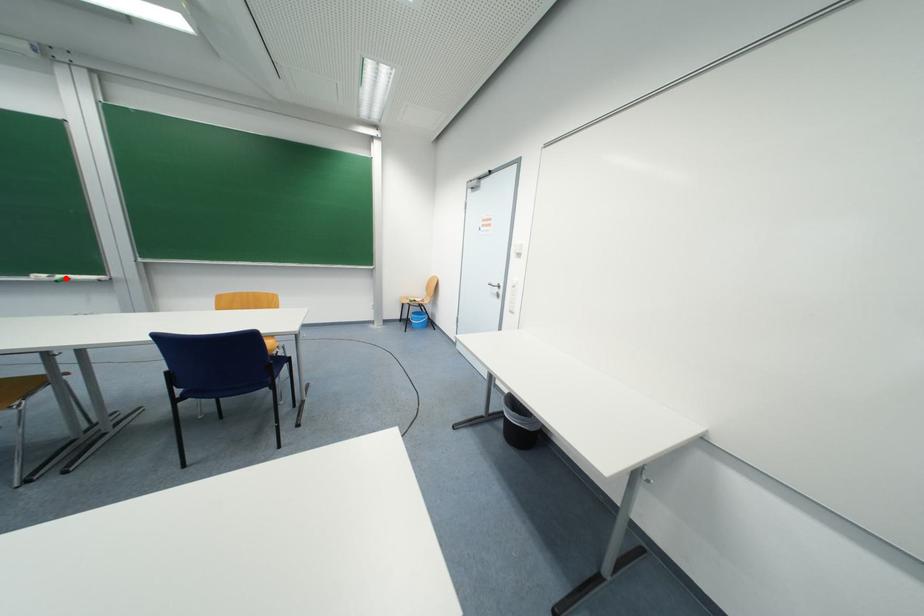
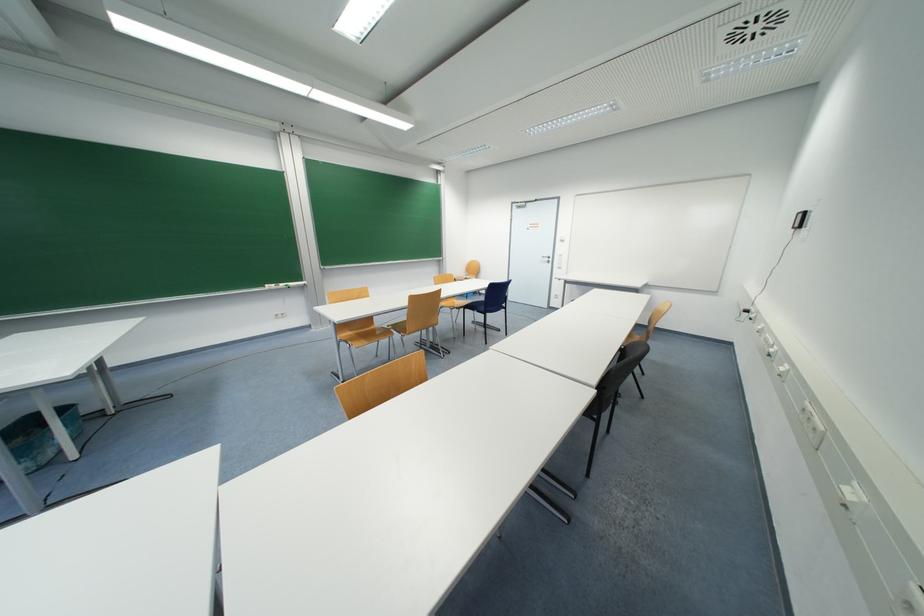
Where in the second image is the point corresponding to the highlighted location from the first image?

(286, 286)